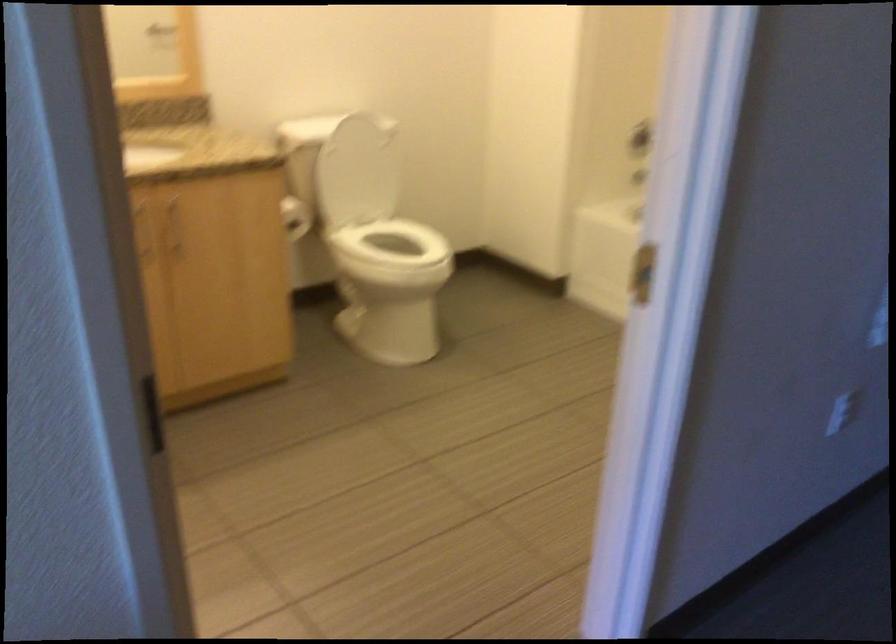
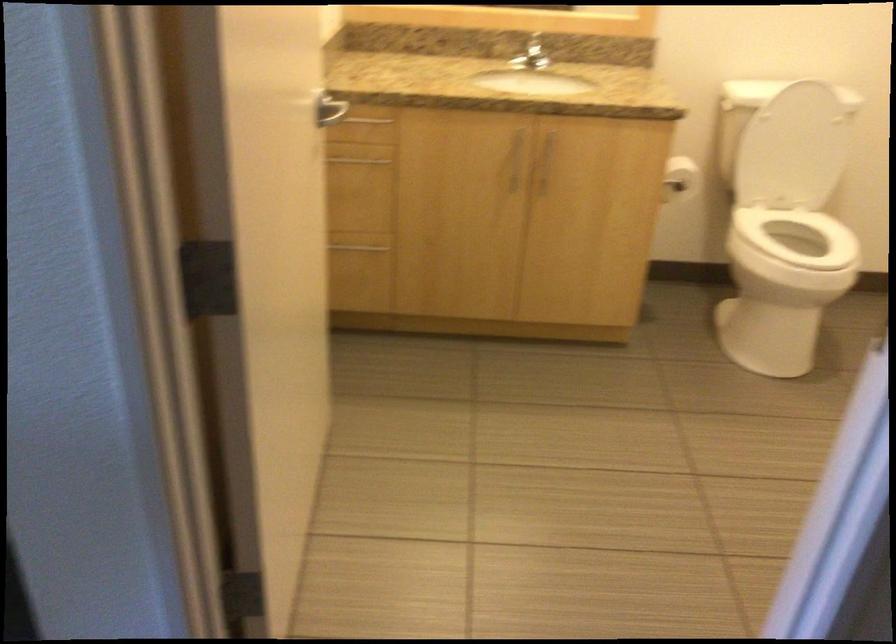
The point at [176,223] is marked in the first image. Where is the corresponding point in the second image?

(545, 162)